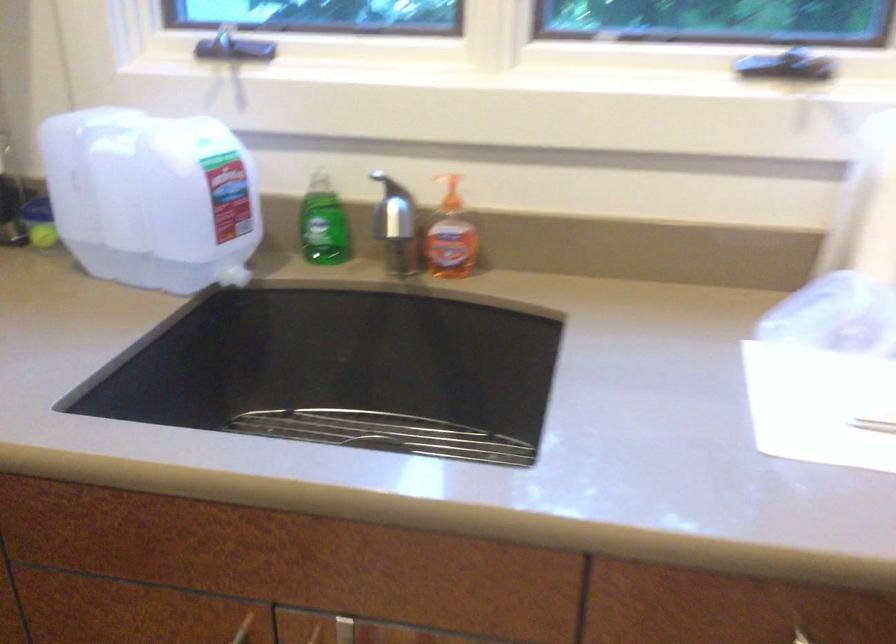
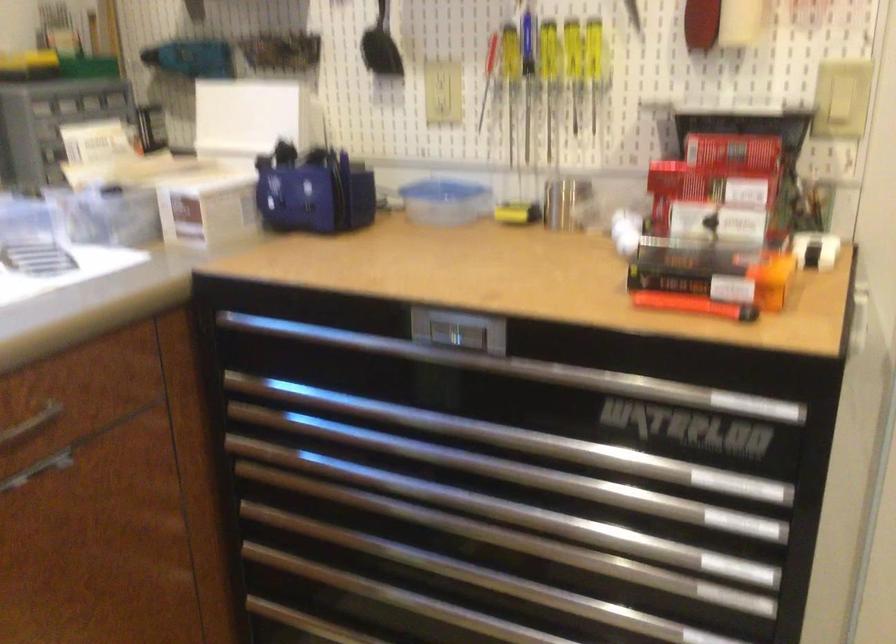
Question: How did the camera likely rotate?

Choices:
 (A) Left
 (B) Right
 (C) Up
 (D) Down

Answer: (B)